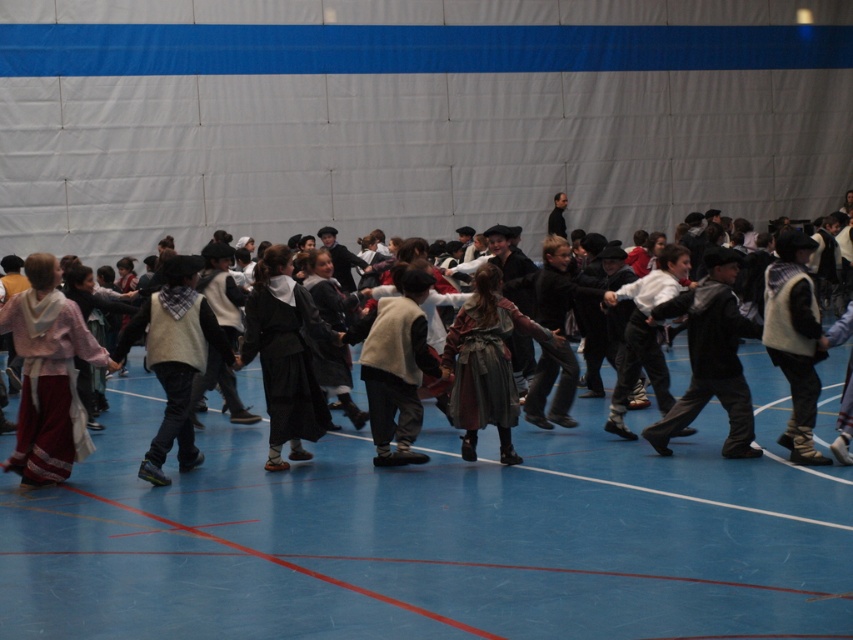
Question: Which object appears farthest from the camera in this image?

Choices:
 (A) blue rubber floor at center
 (B) velvet black vest at center

Answer: (A)

Question: Which of the following is the closest to the observer?

Choices:
 (A) velvet black vest at center
 (B) blue rubber floor at center

Answer: (A)

Question: Is blue rubber floor at center to the right of velvet black vest at center from the viewer's perspective?

Choices:
 (A) yes
 (B) no

Answer: (A)

Question: Is blue rubber floor at center above velvet black vest at center?

Choices:
 (A) yes
 (B) no

Answer: (B)

Question: Can you confirm if blue rubber floor at center is smaller than velvet black vest at center?

Choices:
 (A) yes
 (B) no

Answer: (A)